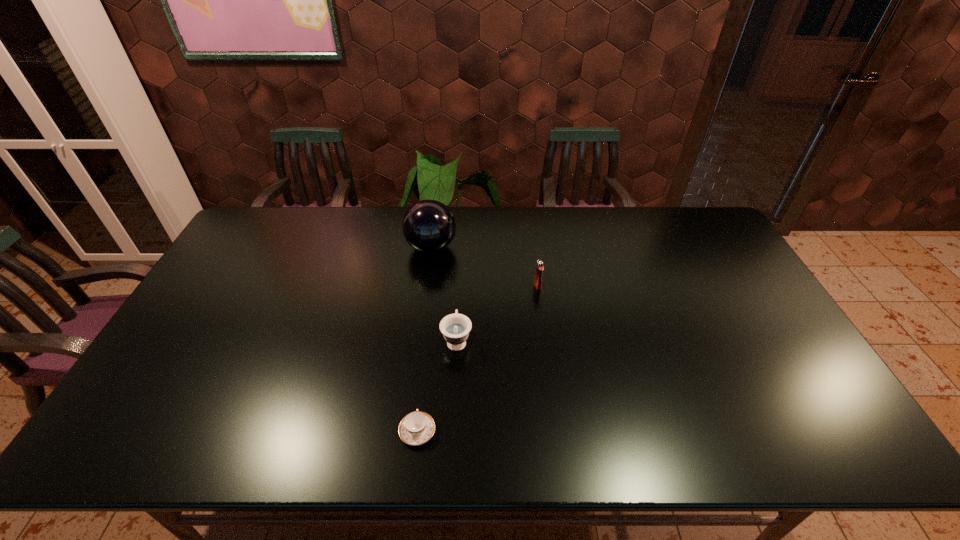
At what (x,y) coordinates should I click in order to perform the action: click on vacant area at the left edge of the desktop. Please return your answer as a coordinate pair (x, y). Looking at the image, I should click on (204, 355).

You are a GUI agent. You are given a task and a screenshot of the screen. Output one action in this format:
    pyautogui.click(x=<x>, y=<y>)
    Task: Click on the free space at the right edge
    
    Given the screenshot: What is the action you would take?
    pyautogui.click(x=724, y=252)

Locate an element on the screen. The width and height of the screenshot is (960, 540). vacant region at the near right corner of the desktop is located at coordinates (848, 453).

The width and height of the screenshot is (960, 540). In order to click on free space between the igniter and the third tallest object in this screenshot , I will do `click(497, 313)`.

The height and width of the screenshot is (540, 960). What are the coordinates of `vacant space that is in between the taller teacup and the second tallest object` in the screenshot? It's located at (497, 313).

The height and width of the screenshot is (540, 960). What are the coordinates of `vacant area between the rightmost object and the shorter teacup` in the screenshot? It's located at (478, 359).

The width and height of the screenshot is (960, 540). Identify the location of vacant space that is in between the taller teacup and the second tallest object. (497, 313).

Locate an element on the screen. vacant space that is in between the igniter and the shortest object is located at coordinates (478, 359).

Locate an element on the screen. The image size is (960, 540). free space between the second shortest object and the rightmost object is located at coordinates (497, 313).

Locate an element on the screen. The height and width of the screenshot is (540, 960). free space between the third farthest object and the igniter is located at coordinates (497, 313).